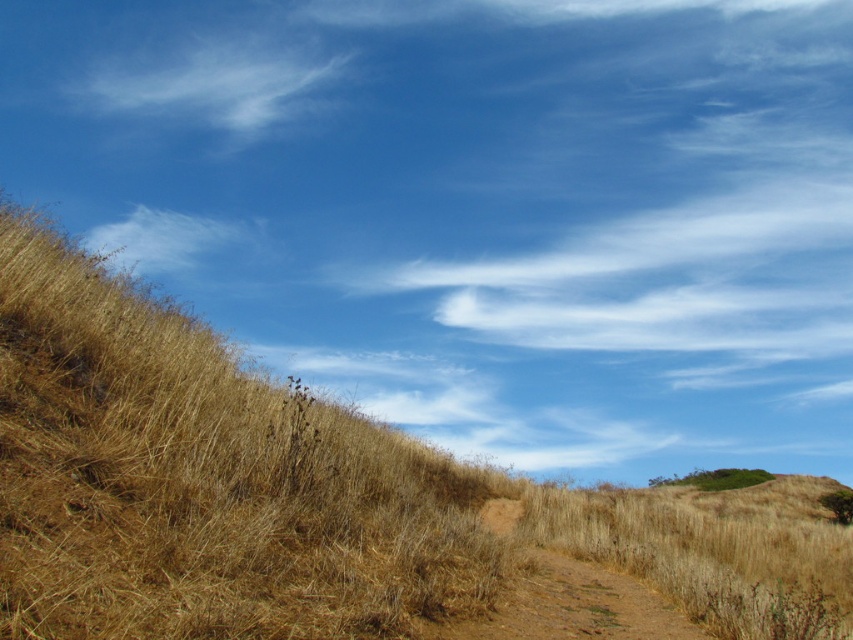
Can you confirm if dry grass at upper left is thinner than white cotton cloud at upper center?

Yes.

Between dry grass at upper left and white cotton cloud at upper center, which one is positioned lower?

dry grass at upper left

Locate an element on the screen. This screenshot has width=853, height=640. dry grass at upper left is located at coordinates (202, 477).